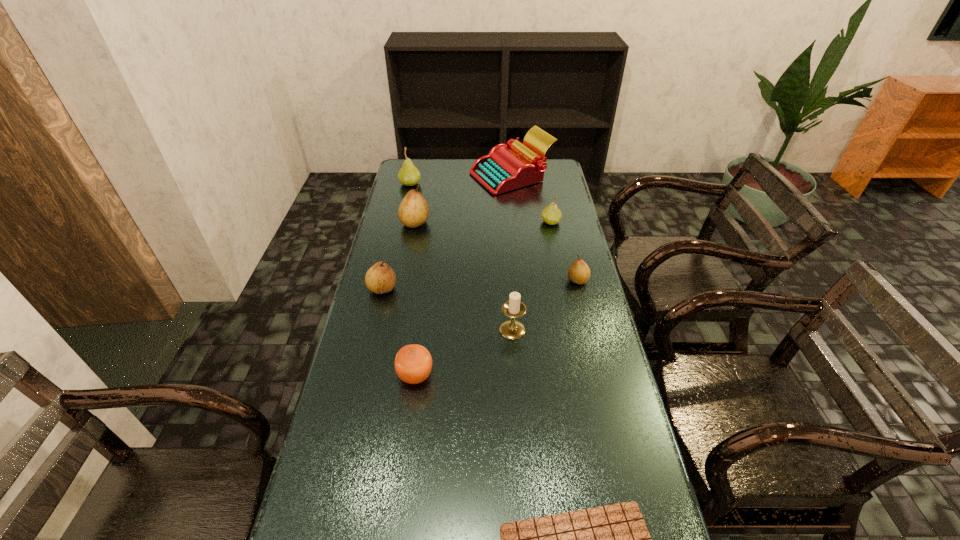
At what (x,y) coordinates should I click in order to perform the action: click on typewriter. Please return your answer as a coordinate pair (x, y). The image size is (960, 540). Looking at the image, I should click on (507, 167).

The height and width of the screenshot is (540, 960). I want to click on the biggest brown pear, so click(x=413, y=211).

You are a GUI agent. You are given a task and a screenshot of the screen. Output one action in this format:
    pyautogui.click(x=<x>, y=<y>)
    Task: Click on the bigger green pear
    The width and height of the screenshot is (960, 540).
    Given the screenshot: What is the action you would take?
    pyautogui.click(x=409, y=175)

You are a GUI agent. You are given a task and a screenshot of the screen. Output one action in this format:
    pyautogui.click(x=<x>, y=<y>)
    Task: Click on the farthest pear
    
    Given the screenshot: What is the action you would take?
    pyautogui.click(x=409, y=175)

Find the location of a particular element. This screenshot has height=540, width=960. candle holder is located at coordinates (511, 329).

Find the location of a particular element. The height and width of the screenshot is (540, 960). the seventh farthest object is located at coordinates pos(511,329).

Find the location of a particular element. The height and width of the screenshot is (540, 960). the second biggest brown pear is located at coordinates (380, 278).

Locate an element on the screen. This screenshot has height=540, width=960. the right green pear is located at coordinates (551, 214).

Find the location of `the smaller green pear`. the smaller green pear is located at coordinates (551, 214).

You are a GUI agent. You are given a task and a screenshot of the screen. Output one action in this format:
    pyautogui.click(x=<x>, y=<y>)
    Task: Click on the orange
    The height and width of the screenshot is (540, 960).
    Given the screenshot: What is the action you would take?
    pyautogui.click(x=413, y=363)